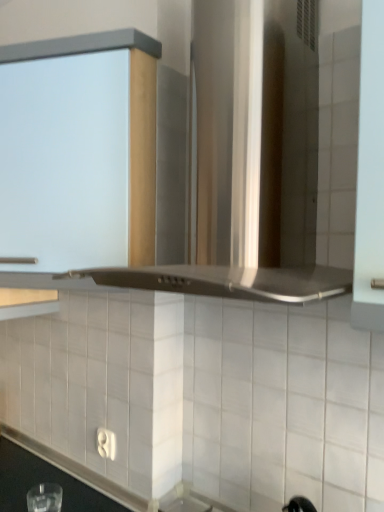
Question: Is stainless steel vent at center spatially inside white matte cabinet at upper left, or outside of it?

Choices:
 (A) inside
 (B) outside

Answer: (B)

Question: Is stainless steel vent at center wider or thinner than white matte cabinet at upper left?

Choices:
 (A) wide
 (B) thin

Answer: (A)

Question: From the image's perspective, is stainless steel vent at center positioned above or below white matte cabinet at upper left?

Choices:
 (A) below
 (B) above

Answer: (B)

Question: From a real-world perspective, is white matte cabinet at upper left physically located above or below stainless steel vent at center?

Choices:
 (A) above
 (B) below

Answer: (B)

Question: In terms of size, does white matte cabinet at upper left appear bigger or smaller than stainless steel vent at center?

Choices:
 (A) small
 (B) big

Answer: (A)

Question: Is point (3, 138) positioned closer to the camera than point (322, 272)?

Choices:
 (A) closer
 (B) farther

Answer: (B)

Question: Considering the relative positions of white matte cabinet at upper left and stainless steel vent at center in the image provided, is white matte cabinet at upper left to the left or to the right of stainless steel vent at center?

Choices:
 (A) left
 (B) right

Answer: (A)